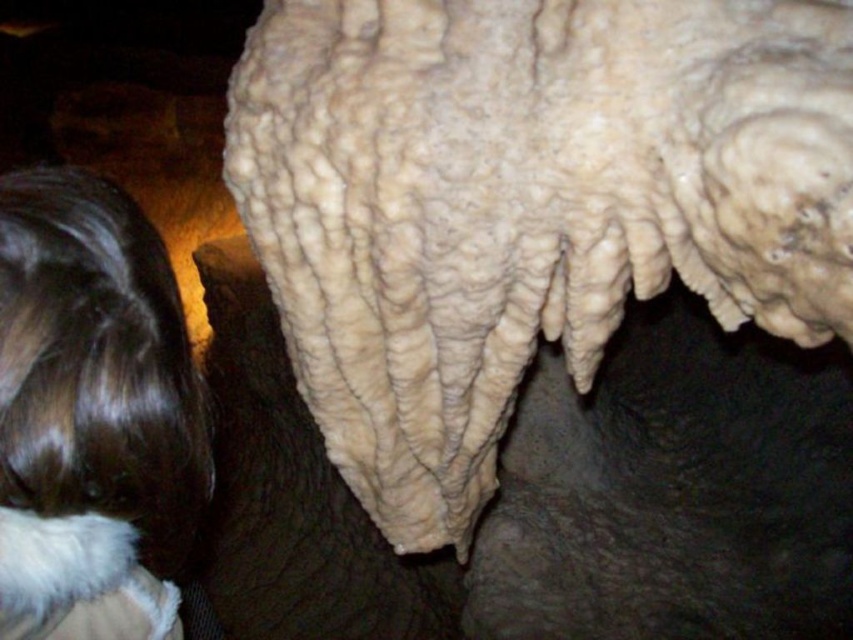
Consider the image. You are a photographer inside a cave. You want to take a photo of the white textured rock at center and the brown hair at upper left so that both are in focus. The camera you are using has a depth of field that can only cover 30 inches. Can you capture both objects clearly in the same photo?

The white textured rock at center and brown hair at upper left are 35.58 inches apart. Since the camera can only cover 30 inches, they are too far apart to both be in focus in the same photo.

You are a photographer taking a picture of the white textured rock at center and the brown hair at upper left. Which object should you focus on first if you want to capture both in the same frame?

The white textured rock at center is positioned on the right side of brown hair at upper left, so you should focus on the brown hair at upper left first to ensure both are in the frame.